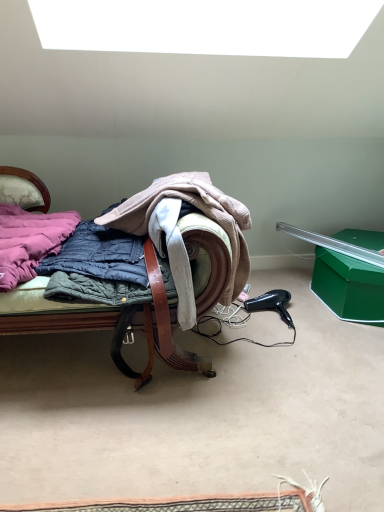
Where is `free space that is to the left of black plastic hair dryer at lower right`? free space that is to the left of black plastic hair dryer at lower right is located at coordinates (244, 317).